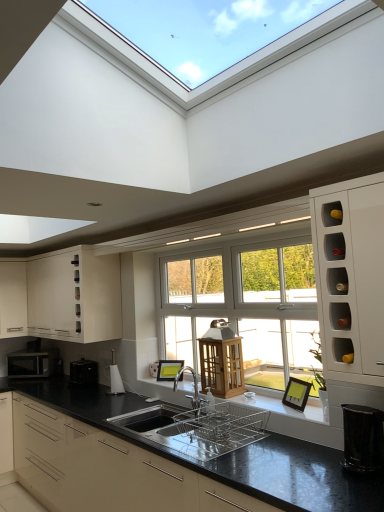
At what (x,y) coordinates should I click in order to perform the action: click on unoccupied area in front of matte black kettle at lower center, which ranks as the second appliance in back-to-front order. Please return your answer as a coordinate pair (x, y). Looking at the image, I should click on (120, 396).